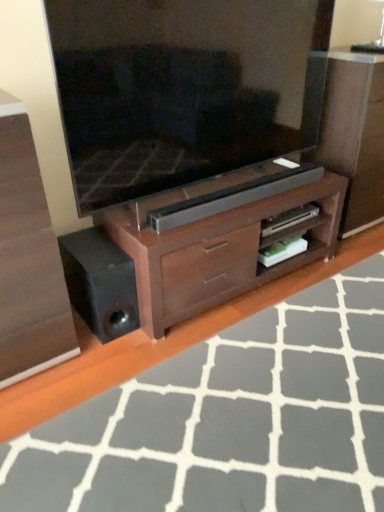
Question: Is wooden floor at lower center taller or shorter than wooden dresser at center?

Choices:
 (A) tall
 (B) short

Answer: (B)

Question: Would you say wooden floor at lower center is inside or outside wooden dresser at center?

Choices:
 (A) inside
 (B) outside

Answer: (B)

Question: Based on their relative distances, which object is nearer to the wooden floor at lower center?

Choices:
 (A) matte wood chest of drawers at center
 (B) brown wood tv cabinet at center
 (C) matte black television at center
 (D) wooden dresser at center

Answer: (B)

Question: Which object is positioned closest to the wooden floor at lower center?

Choices:
 (A) matte black television at center
 (B) wooden dresser at center
 (C) brown wood tv cabinet at center
 (D) matte wood chest of drawers at center

Answer: (C)